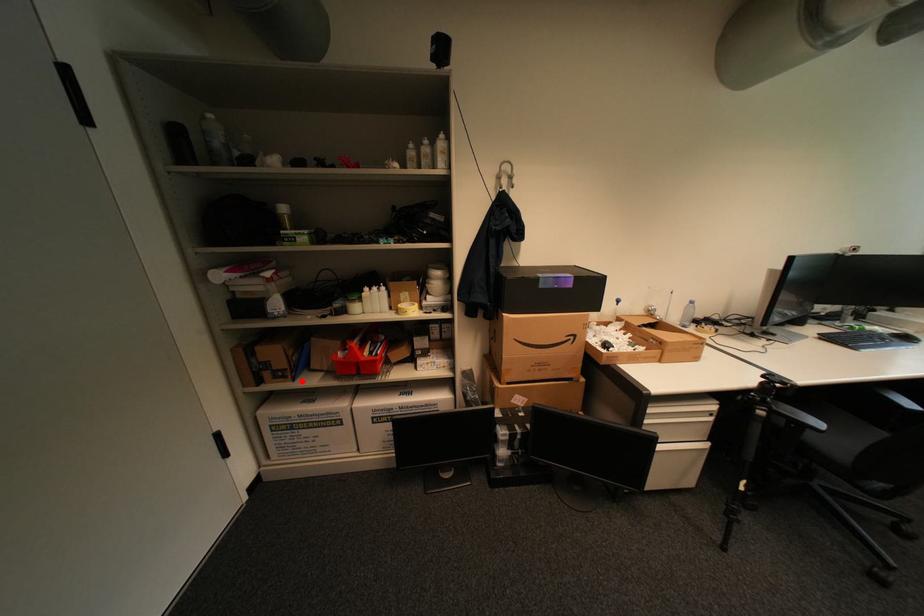
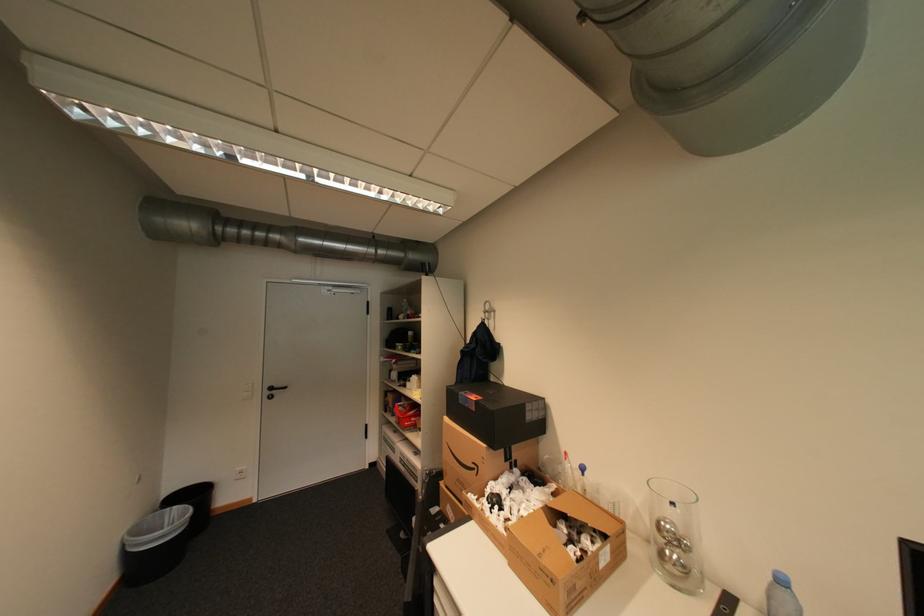
Question: A red point is marked in image1. In image2, is the corresponding 3D point closer to the camera or farther? Reply with the corresponding letter.

Choices:
 (A) The corresponding 3D point is closer.
 (B) The corresponding 3D point is farther.

Answer: (B)